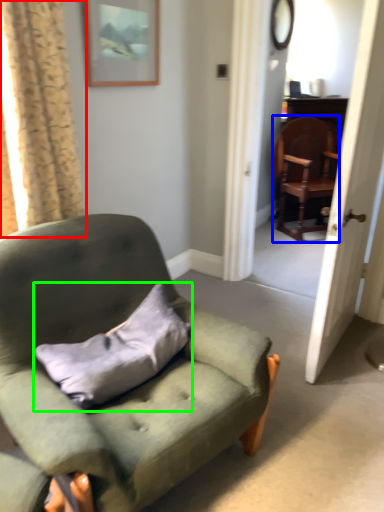
Question: Which object is positioned farthest from curtain (highlighted by a red box)? Select from chair (highlighted by a blue box) and pillow (highlighted by a green box).

Choices:
 (A) chair
 (B) pillow

Answer: (A)